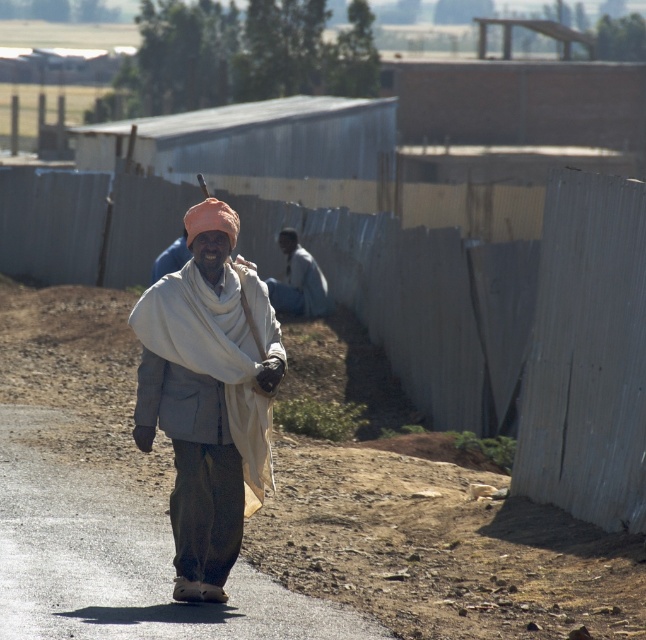
Question: Is light brown fabric turban at center to the right of dark gray fabric at center from the viewer's perspective?

Choices:
 (A) no
 (B) yes

Answer: (A)

Question: Does light brown fabric turban at center have a lesser width compared to dark gray fabric at center?

Choices:
 (A) yes
 (B) no

Answer: (B)

Question: Considering the relative positions of light brown fabric turban at center and dark gray fabric at center in the image provided, where is light brown fabric turban at center located with respect to dark gray fabric at center?

Choices:
 (A) above
 (B) below

Answer: (B)

Question: Which object is farther from the camera taking this photo?

Choices:
 (A) light brown fabric turban at center
 (B) dark gray fabric at center

Answer: (B)

Question: Which object is farther from the camera taking this photo?

Choices:
 (A) light brown fabric turban at center
 (B) dark gray fabric at center

Answer: (B)